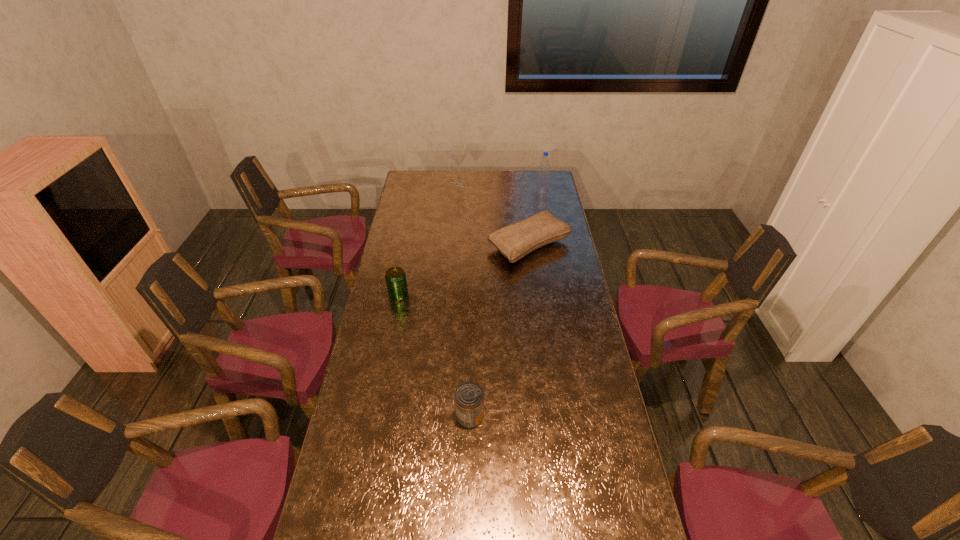
This screenshot has height=540, width=960. I want to click on vacant space that satisfies the following two spatial constraints: 1. on the back side of the flute glass; 2. on the left side of the beer can, so click(420, 184).